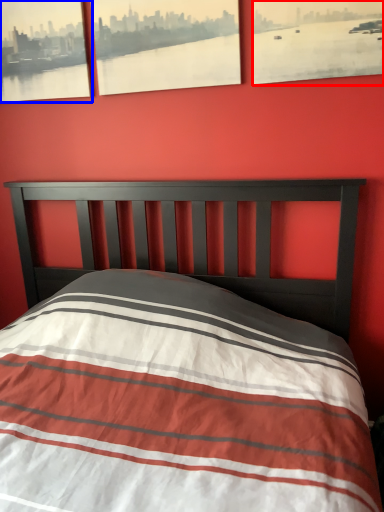
Question: Among these objects, which one is farthest to the camera, picture frame (highlighted by a red box) or picture frame (highlighted by a blue box)?

Choices:
 (A) picture frame
 (B) picture frame

Answer: (B)